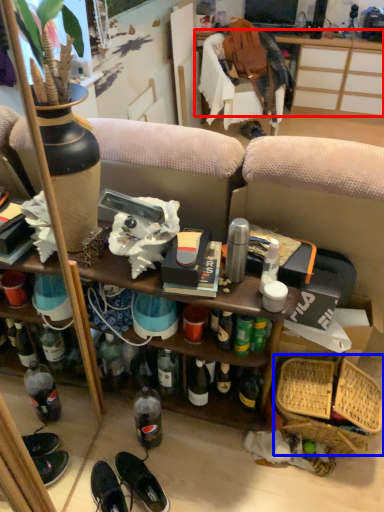
Question: Which point is closer to the camera, desk (highlighted by a red box) or basket (highlighted by a blue box)?

Choices:
 (A) desk
 (B) basket

Answer: (B)